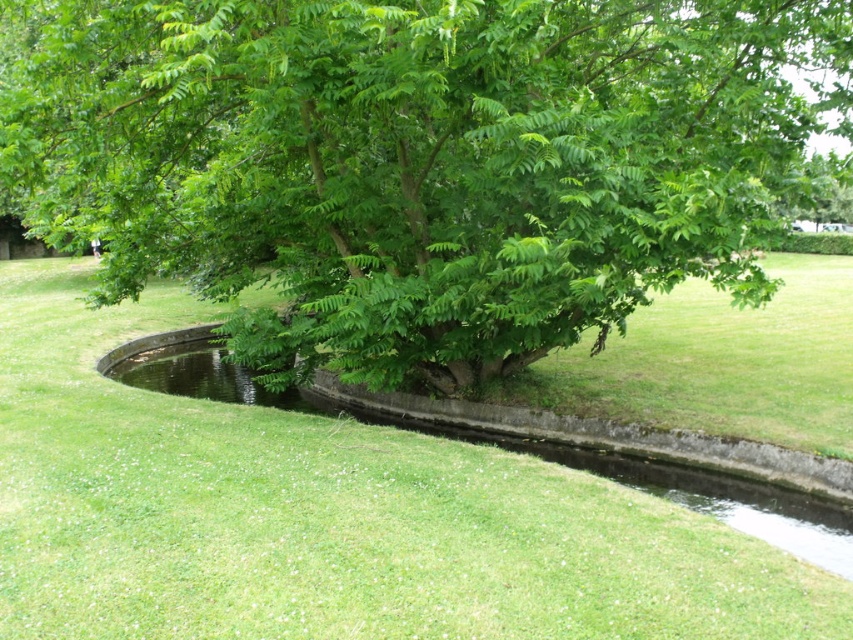
You are standing at the edge of the water feature and want to walk to the green leafy tree at center. Which direction should you move relative to the clear water at center?

You should move to the right relative to the clear water at center because the green leafy tree at center is located to the right of the clear water at center.

Based on the photo, you are standing in the outdoor scene and want to take a photo of the green leafy tree at center. If your camera can focus on objects up to 6 meters away, will you need to adjust your position to capture the tree clearly?

The green leafy tree at center is 6.30 meters from the viewer. Since the camera can focus up to 6 meters, you need to move closer to ensure the tree is within the camera range.

You are standing at the edge of the curved water feature and want to place a small decorative rock exactly at point (416, 161). Based on the scene description, where will this point be located?

The point (416, 161) is on the green leafy tree at center, so placing the decorative rock there would position it on the tree itself.